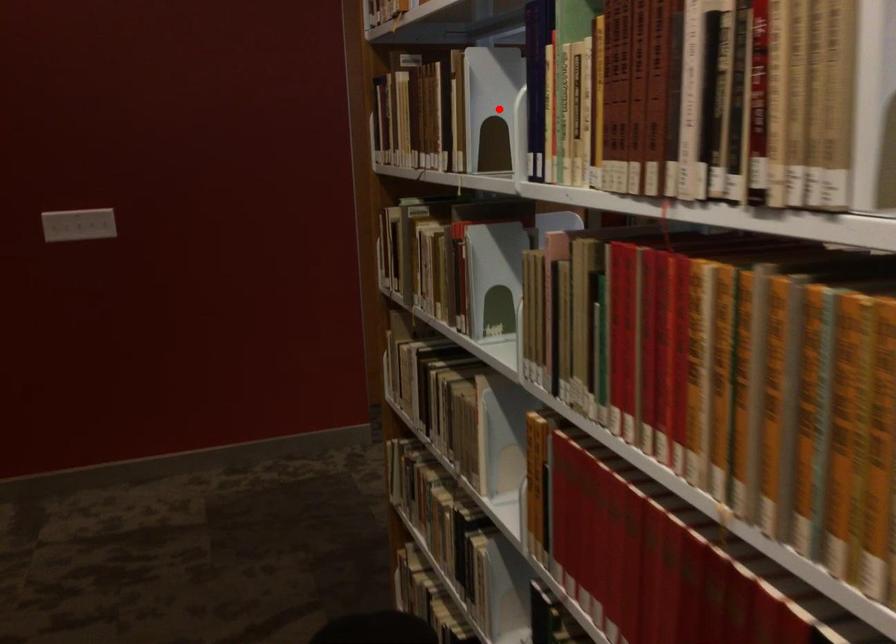
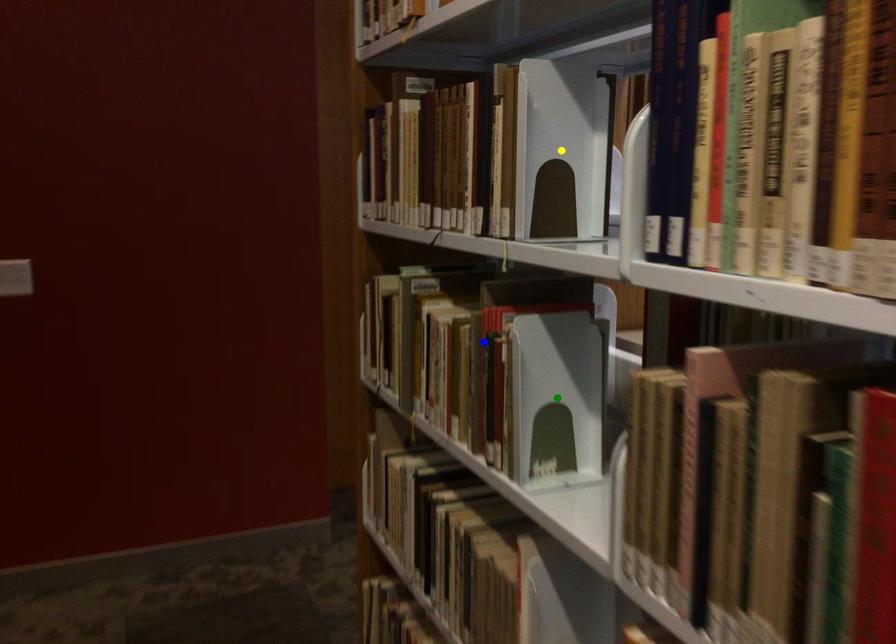
Question: I am providing you with two images of the same scene from different viewpoints. A red point is marked on the first image. You are given multiple points on the second image. Which spot in image 2 lines up with the point in image 1?

Choices:
 (A) green point
 (B) yellow point
 (C) blue point

Answer: (B)